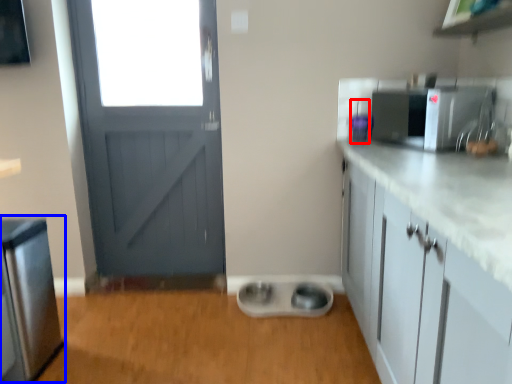
Question: Among these objects, which one is nearest to the camera, appliance (highlighted by a red box) or appliance (highlighted by a blue box)?

Choices:
 (A) appliance
 (B) appliance

Answer: (B)